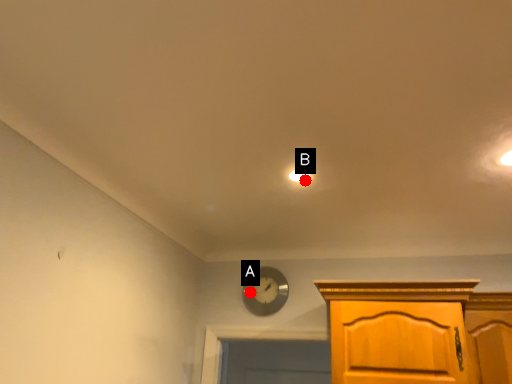
Question: Two points are circled on the image, labeled by A and B beside each circle. Which point is closer to the camera?

Choices:
 (A) A is closer
 (B) B is closer

Answer: (B)